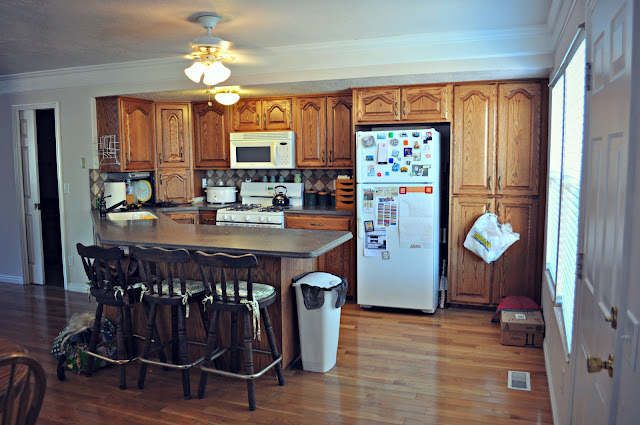
I want to click on trash can, so click(x=315, y=328).